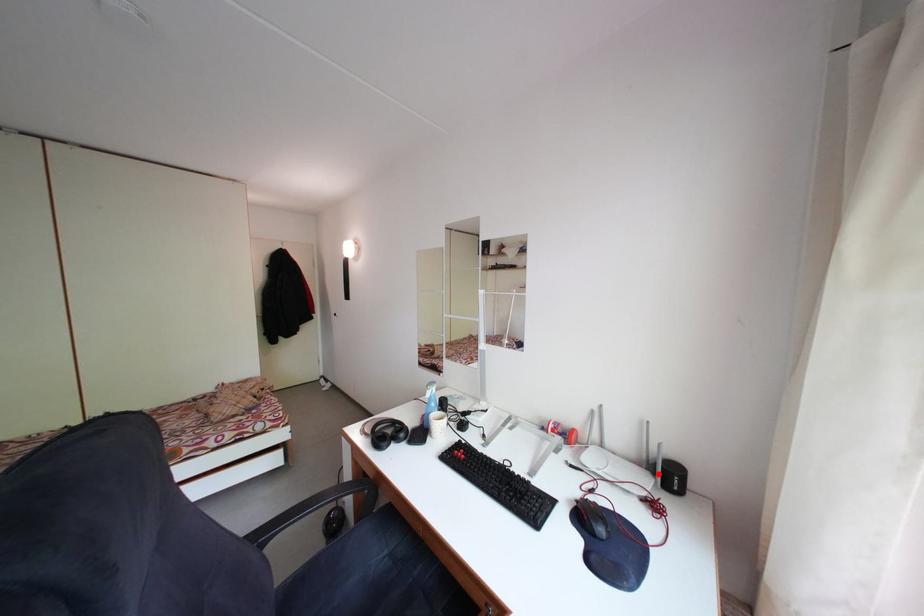
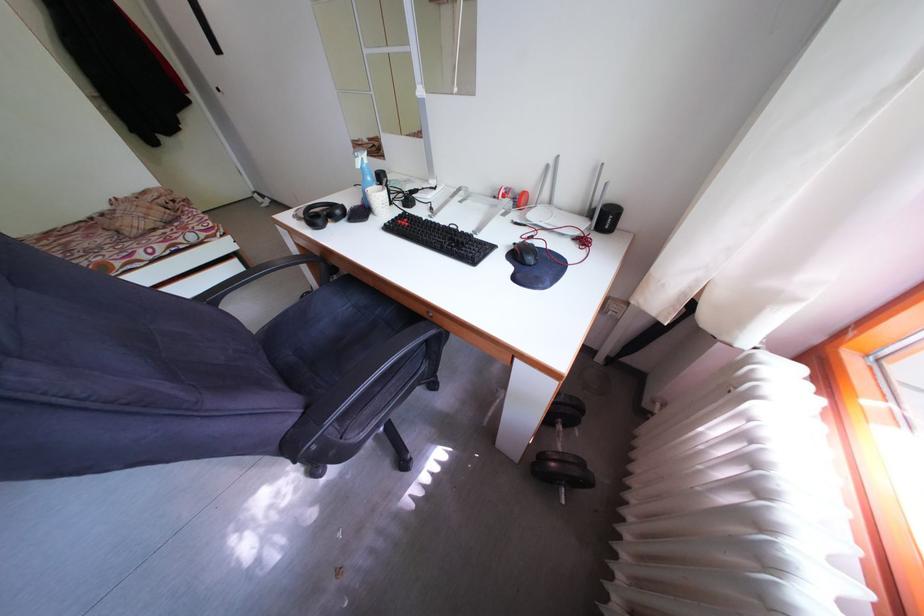
Where in the second image is the point corresponding to the highlighted location from the first image?

(599, 220)